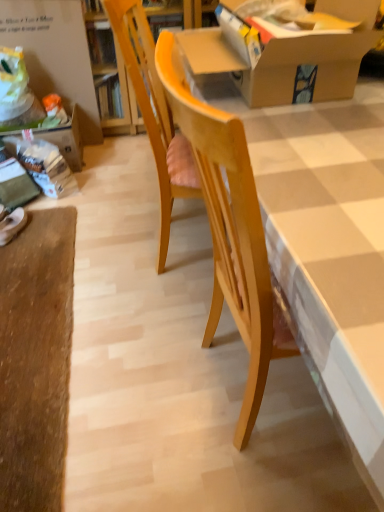
Question: Is wooden table at center closer to the viewer compared to white cardboard at upper left?

Choices:
 (A) yes
 (B) no

Answer: (A)

Question: From the image's perspective, would you say wooden table at center is positioned over white cardboard at upper left?

Choices:
 (A) yes
 (B) no

Answer: (B)

Question: Does wooden table at center have a lesser height compared to white cardboard at upper left?

Choices:
 (A) yes
 (B) no

Answer: (A)

Question: From a real-world perspective, is wooden table at center positioned over white cardboard at upper left based on gravity?

Choices:
 (A) no
 (B) yes

Answer: (A)

Question: Is wooden table at center bigger than white cardboard at upper left?

Choices:
 (A) yes
 (B) no

Answer: (A)

Question: Does wooden table at center have a smaller size compared to white cardboard at upper left?

Choices:
 (A) yes
 (B) no

Answer: (B)

Question: Could you tell me if white cardboard at upper left is facing cardboard box at upper center?

Choices:
 (A) yes
 (B) no

Answer: (B)

Question: Is white cardboard at upper left beside cardboard box at upper center?

Choices:
 (A) yes
 (B) no

Answer: (B)

Question: Would you say white cardboard at upper left contains cardboard box at upper center?

Choices:
 (A) no
 (B) yes

Answer: (A)

Question: From a real-world perspective, is white cardboard at upper left located higher than cardboard box at upper center?

Choices:
 (A) yes
 (B) no

Answer: (B)

Question: Would you say white cardboard at upper left is outside cardboard box at upper center?

Choices:
 (A) yes
 (B) no

Answer: (A)

Question: Can you confirm if white cardboard at upper left is taller than cardboard box at upper center?

Choices:
 (A) no
 (B) yes

Answer: (B)

Question: Considering the relative positions of white matte shoe at lower left and wooden table at center in the image provided, is white matte shoe at lower left to the left of wooden table at center from the viewer's perspective?

Choices:
 (A) yes
 (B) no

Answer: (A)